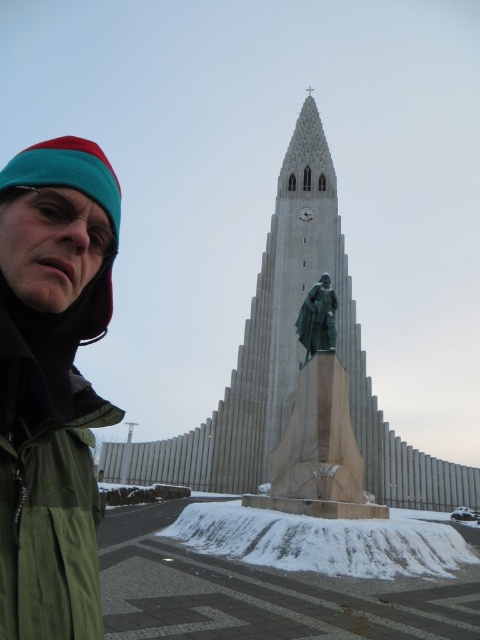
From the picture: Does green polished statue at center lie in front of bronze statue at center?

Yes, it is in front of bronze statue at center.

Which is more to the right, green polished statue at center or bronze statue at center?

Positioned to the right is bronze statue at center.

The height and width of the screenshot is (640, 480). Find the location of `green polished statue at center`. green polished statue at center is located at coordinates (319, 428).

Between point (93, 611) and point (326, 320), which one is positioned behind?

Positioned behind is point (326, 320).

Is green matte jacket at lower left further to camera compared to green polished statue at center?

No, green matte jacket at lower left is in front of green polished statue at center.

You are a GUI agent. You are given a task and a screenshot of the screen. Output one action in this format:
    pyautogui.click(x=<x>, y=<y>)
    Task: Click on the green matte jacket at lower left
    The width and height of the screenshot is (480, 640).
    Given the screenshot: What is the action you would take?
    pyautogui.click(x=48, y=476)

At what (x,y) coordinates should I click in order to perform the action: click on green matte jacket at lower left. Please return your answer as a coordinate pair (x, y). Looking at the image, I should click on (48, 476).

Who is taller, light gray stone tower at center or green matte jacket at lower left?

light gray stone tower at center

Does light gray stone tower at center have a greater height compared to green matte jacket at lower left?

Indeed, light gray stone tower at center has a greater height compared to green matte jacket at lower left.

Who is more forward, (273, 362) or (7, 355)?

Positioned in front is point (7, 355).

Find the location of `light gray stone tower at center`. light gray stone tower at center is located at coordinates (299, 362).